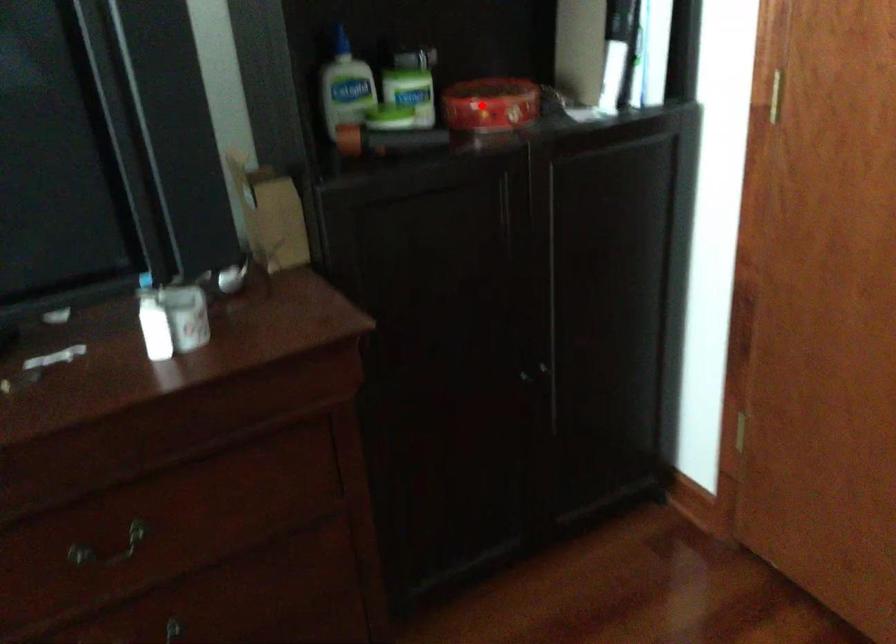
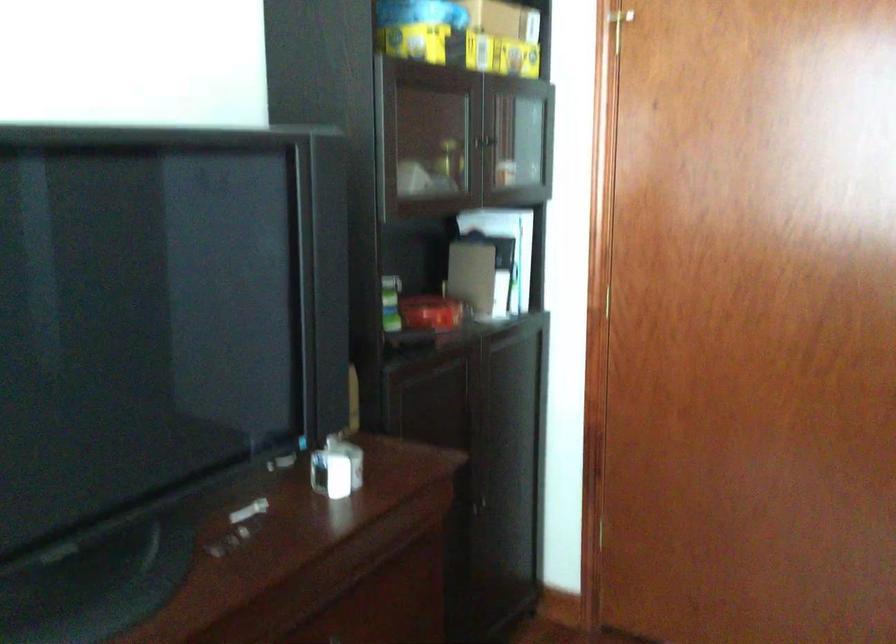
Question: I am providing you with two images of the same scene from different viewpoints. Given a red point in image1, look at the same physical point in image2. Is it:

Choices:
 (A) Closer to the viewpoint
 (B) Farther from the viewpoint

Answer: (B)